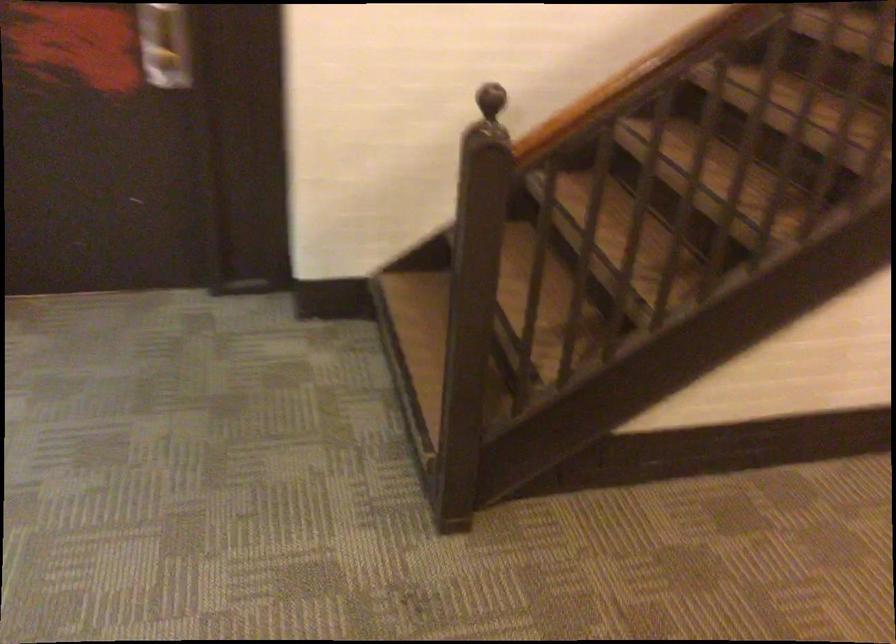
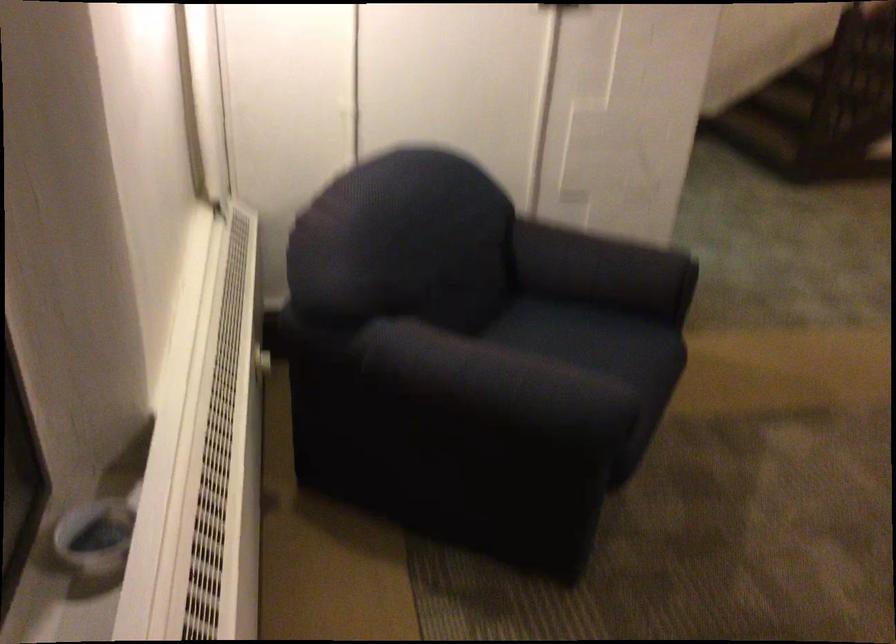
In a continuous first-person perspective shot, in which direction is the camera moving?

The cameraman walked toward left, backward.